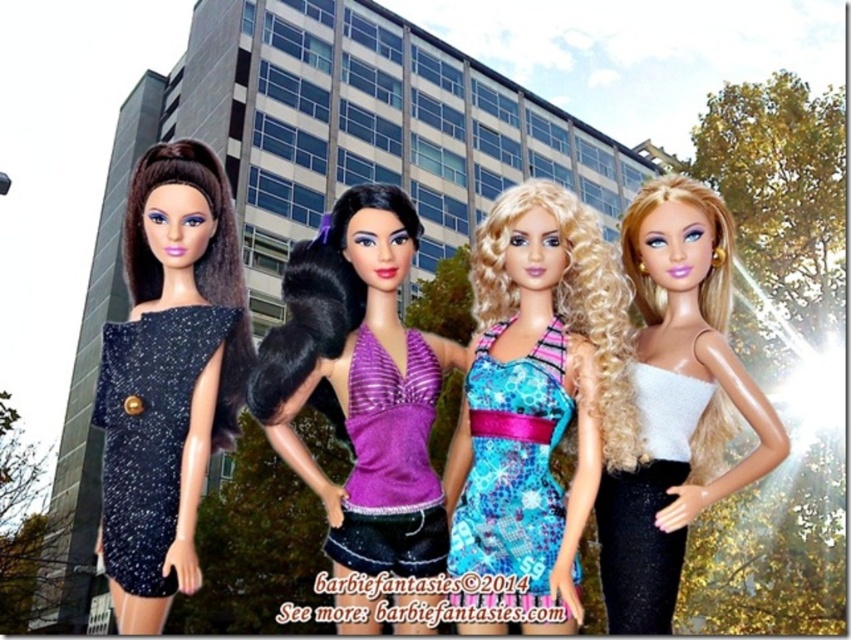
You are standing in front of the dolls and want to take a photo. Which point, point (x=467, y=540) or point (x=438, y=548), is closer to you?

Point (x=467, y=540) is closer to the camera than point (x=438, y=548), so it is closer to you.